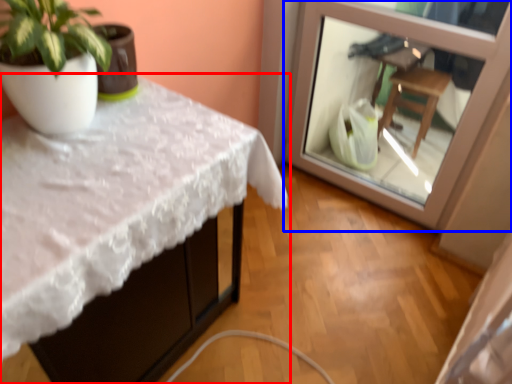
Question: Which point is further to the camera, table (highlighted by a red box) or glass door (highlighted by a blue box)?

Choices:
 (A) table
 (B) glass door

Answer: (B)